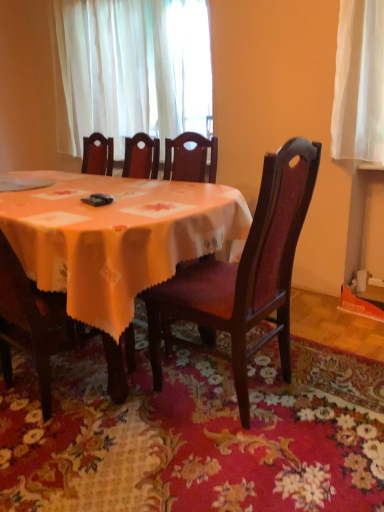
Identify the location of empty space that is ontop of matte orange tablecloth at center (from a real-world perspective). (98, 186).